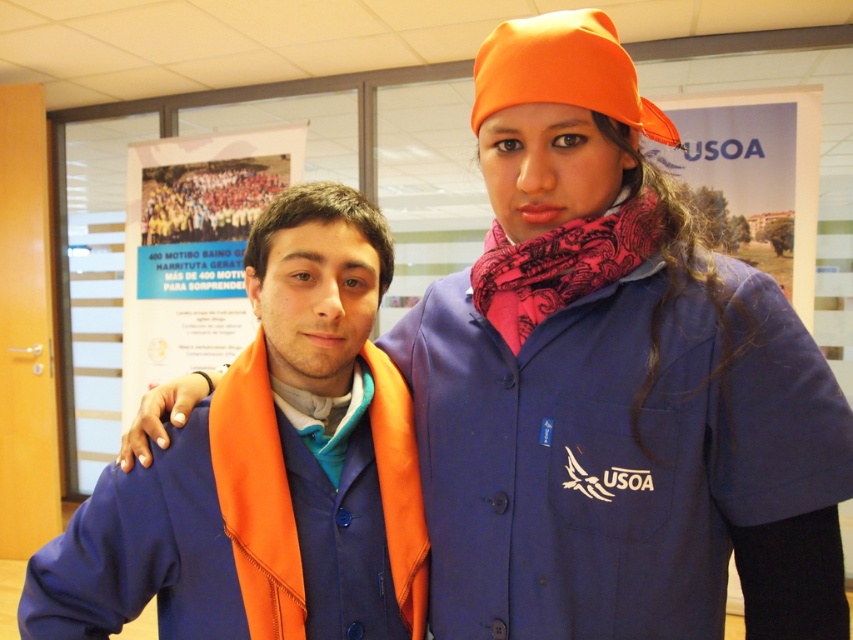
Question: Is the position of orange fabric hat at upper center more distant than that of pink patterned scarf at center?

Choices:
 (A) yes
 (B) no

Answer: (B)

Question: Which of the following is the farthest from the observer?

Choices:
 (A) orange fabric jacket at left
 (B) orange fabric at center
 (C) orange fabric hat at upper center

Answer: (B)

Question: Which point is closer to the camera?

Choices:
 (A) (254, 208)
 (B) (618, 269)
 (C) (213, 586)
 (D) (590, 74)

Answer: (D)

Question: Can you confirm if orange fabric jacket at left is thinner than pink patterned scarf at center?

Choices:
 (A) yes
 (B) no

Answer: (B)

Question: Which point is closer to the camera?

Choices:
 (A) 477,67
 (B) 228,170

Answer: (A)

Question: Does pink patterned scarf at center have a lesser width compared to orange fabric at center?

Choices:
 (A) yes
 (B) no

Answer: (A)